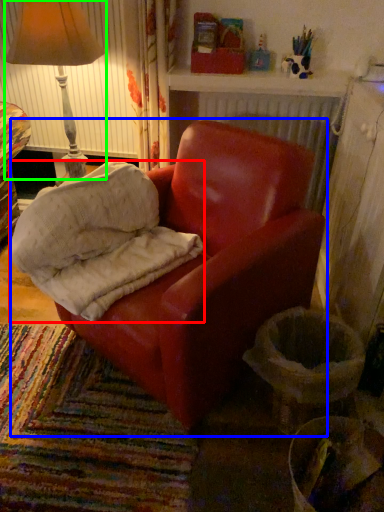
Question: Which object is the closest to the material (highlighted by a red box)? Choose among these: chair (highlighted by a blue box) or lamp (highlighted by a green box).

Choices:
 (A) chair
 (B) lamp

Answer: (A)